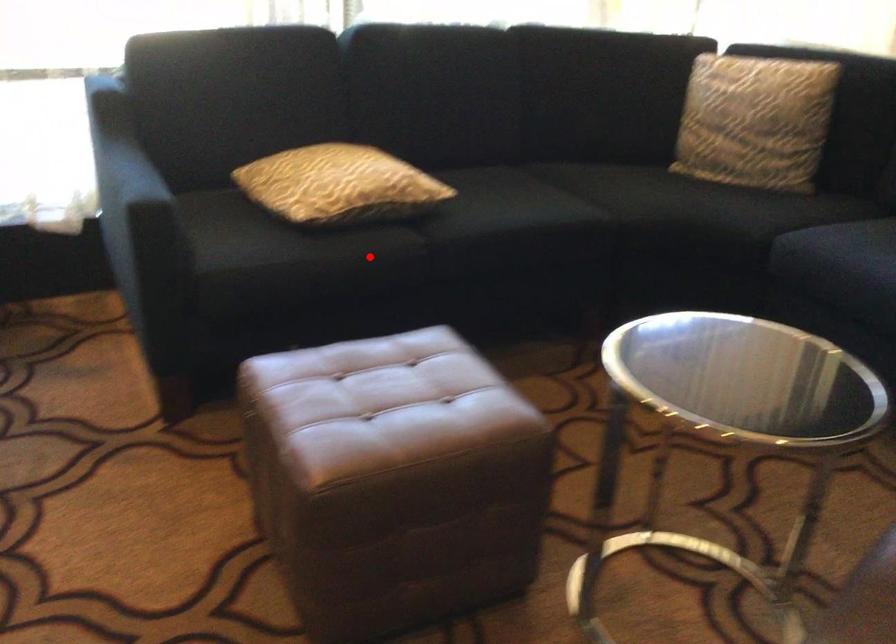
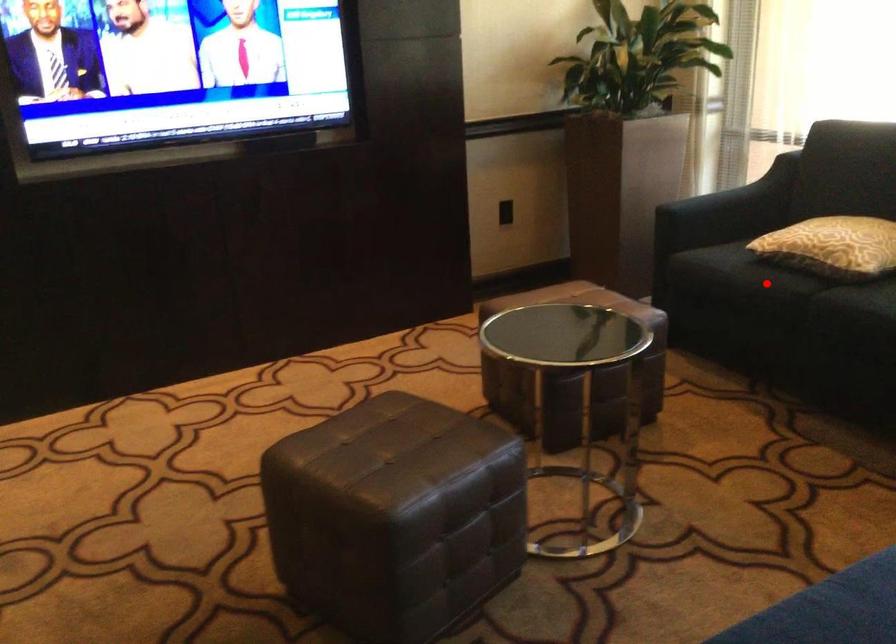
Based on the photo, I am providing you with two images of the same scene from different viewpoints. A red point is marked on the first image and another point is marked on the second image. Is the marked point in image1 the same physical position as the marked point in image2?

Yes